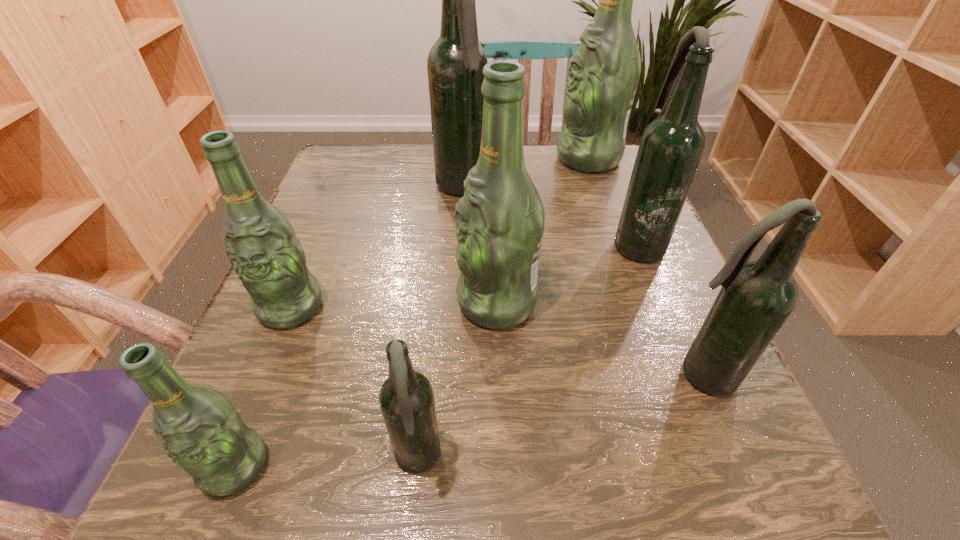
Find the location of `the smallest green beer bottle`. the smallest green beer bottle is located at coordinates (199, 428).

Where is `vacant position located 0.170m on the surface of the rightmost green beer bottle`? vacant position located 0.170m on the surface of the rightmost green beer bottle is located at coordinates (486, 159).

The height and width of the screenshot is (540, 960). What are the coordinates of `free space located on the surface of the rightmost green beer bottle` in the screenshot? It's located at (457, 159).

This screenshot has width=960, height=540. I want to click on vacant space located 0.120m on the surface of the rightmost green beer bottle, so click(506, 159).

Identify the location of free spot located 0.150m on the left of the farthest dark beer bottle. The width and height of the screenshot is (960, 540). (368, 189).

At what (x,y) coordinates should I click in order to perform the action: click on vacant space located 0.140m on the front of the second farthest dark beer bottle. Please return your answer as a coordinate pair (x, y). The image size is (960, 540). Looking at the image, I should click on (670, 325).

The width and height of the screenshot is (960, 540). What are the coordinates of `free location located on the surface of the third green beer bottle from left to right` in the screenshot? It's located at (409, 302).

Find the location of a particular element. The height and width of the screenshot is (540, 960). free space located 0.220m on the surface of the third green beer bottle from left to right is located at coordinates (324, 302).

The width and height of the screenshot is (960, 540). I want to click on vacant space situated on the surface of the third green beer bottle from left to right, so click(396, 302).

Find the location of a particular element. vacant space situated on the surface of the second smallest green beer bottle is located at coordinates (252, 401).